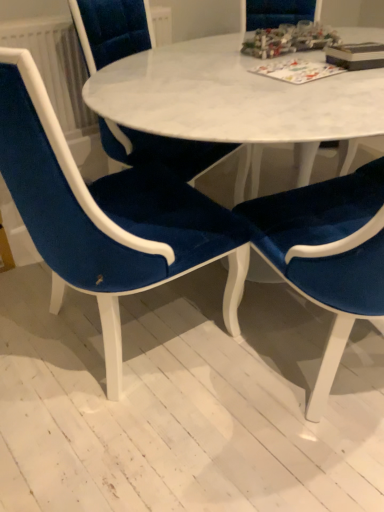
Describe the element at coordinates (55, 65) in the screenshot. I see `white textured radiator at upper left` at that location.

Measure the distance between point (x=322, y=244) and camera.

Point (x=322, y=244) and camera are 39.29 inches apart.

What is the approximate width of hardcover book at upper right, the 2th book in the left-to-right sequence?

The width of hardcover book at upper right, the 2th book in the left-to-right sequence, is 7.43 inches.

Find the location of a particular element. matte paper board game at upper center, the 2th book from the right is located at coordinates (297, 70).

Consider the image. Is velvet blue chair at center, which ranks as the 1th chair in right-to-left order, to the left of hardcover book at upper right, which is the 1th book in right-to-left order, from the viewer's perspective?

Indeed, velvet blue chair at center, which ranks as the 1th chair in right-to-left order, is positioned on the left side of hardcover book at upper right, which is the 1th book in right-to-left order.

Is velvet blue chair at center, the third chair positioned from the left, facing away from hardcover book at upper right, the 2th book in the left-to-right sequence?

No.

From the image's perspective, is velvet blue chair at center, which ranks as the 1th chair in right-to-left order, beneath hardcover book at upper right, which is the 1th book in right-to-left order?

Yes, from the image's perspective, velvet blue chair at center, which ranks as the 1th chair in right-to-left order, is beneath hardcover book at upper right, which is the 1th book in right-to-left order.

Can you confirm if velvet blue chair at center, which ranks as the 1th chair in right-to-left order, is thinner than hardcover book at upper right, which is the 1th book in right-to-left order?

Incorrect, the width of velvet blue chair at center, which ranks as the 1th chair in right-to-left order, is not less than that of hardcover book at upper right, which is the 1th book in right-to-left order.

Considering the sizes of matte paper board game at upper center, the 2th book from the right, and velvet blue chair at center, which ranks as the 1th chair in right-to-left order, in the image, is matte paper board game at upper center, the 2th book from the right, wider or thinner than velvet blue chair at center, which ranks as the 1th chair in right-to-left order,?

Clearly, matte paper board game at upper center, the 2th book from the right, has less width compared to velvet blue chair at center, which ranks as the 1th chair in right-to-left order.

From the image's perspective, is matte paper board game at upper center, acting as the first book starting from the left, located above or below velvet blue chair at center, which ranks as the 1th chair in right-to-left order?

matte paper board game at upper center, acting as the first book starting from the left, is situated higher than velvet blue chair at center, which ranks as the 1th chair in right-to-left order, in the image.

Find the location of `the 3rd chair in front of the matte paper board game at upper center, the 2th book from the right, starting your count from the anchor`. the 3rd chair in front of the matte paper board game at upper center, the 2th book from the right, starting your count from the anchor is located at coordinates (327, 253).

From the image's perspective, who appears lower, velvet blue chair at lower left, the 3th chair in the right-to-left sequence, or white textured radiator at upper left?

velvet blue chair at lower left, the 3th chair in the right-to-left sequence, is shown below in the image.

Considering the relative sizes of velvet blue chair at lower left, the 3th chair in the right-to-left sequence, and white textured radiator at upper left in the image provided, is velvet blue chair at lower left, the 3th chair in the right-to-left sequence, taller than white textured radiator at upper left?

Yes.

Are velvet blue chair at lower left, the 3th chair in the right-to-left sequence, and white textured radiator at upper left beside each other?

No, velvet blue chair at lower left, the 3th chair in the right-to-left sequence, is not with white textured radiator at upper left.

From a real-world perspective, which is physically below, velvet blue chair at lower left, the 3th chair in the right-to-left sequence, or white textured radiator at upper left?

From a 3D spatial view, velvet blue chair at lower left, the 3th chair in the right-to-left sequence, is below.

Is hardcover book at upper right, which is the 1th book in right-to-left order, in contact with velvet blue chair at lower left, the 3th chair in the right-to-left sequence?

No.

From the image's perspective, between hardcover book at upper right, which is the 1th book in right-to-left order, and velvet blue chair at lower left, which is the 1th chair from left to right, who is located below?

velvet blue chair at lower left, which is the 1th chair from left to right.

Can you confirm if hardcover book at upper right, the 2th book in the left-to-right sequence, is taller than velvet blue chair at lower left, which is the 1th chair from left to right?

No.

The image size is (384, 512). Identify the location of book that is the 2nd object located above the velvet blue chair at lower left, the 3th chair in the right-to-left sequence (from the image's perspective). (356, 55).

Is point (380, 60) closer or farther from the camera than point (295, 61)?

Point (380, 60) is closer to the camera than point (295, 61).

Considering the relative positions of hardcover book at upper right, which is the 1th book in right-to-left order, and matte paper board game at upper center, acting as the first book starting from the left, in the image provided, is hardcover book at upper right, which is the 1th book in right-to-left order, behind matte paper board game at upper center, acting as the first book starting from the left,?

Yes, it is.

Between hardcover book at upper right, the 2th book in the left-to-right sequence, and matte paper board game at upper center, acting as the first book starting from the left, which one has smaller size?

matte paper board game at upper center, acting as the first book starting from the left.

Which is correct: hardcover book at upper right, which is the 1th book in right-to-left order, is inside matte paper board game at upper center, acting as the first book starting from the left, or outside of it?

hardcover book at upper right, which is the 1th book in right-to-left order, is located beyond the bounds of matte paper board game at upper center, acting as the first book starting from the left.

Considering the relative positions of velvet blue chair at center, which ranks as the 1th chair in right-to-left order, and velvet blue chair at center, which is the second chair from left to right, in the image provided, is velvet blue chair at center, which ranks as the 1th chair in right-to-left order, behind velvet blue chair at center, which is the second chair from left to right,?

No, it is not.

From a real-world perspective, count 2nd chairs downward from the velvet blue chair at center, which is the second chair from left to right, and point to it. Please provide its 2D coordinates.

[(327, 253)]

Is velvet blue chair at center, which ranks as the 1th chair in right-to-left order, bigger than velvet blue chair at center, the 2th chair viewed from the right?

Indeed, velvet blue chair at center, which ranks as the 1th chair in right-to-left order, has a larger size compared to velvet blue chair at center, the 2th chair viewed from the right.

Considering the sizes of objects matte paper board game at upper center, the 2th book from the right, and hardcover book at upper right, the 2th book in the left-to-right sequence, in the image provided, who is bigger, matte paper board game at upper center, the 2th book from the right, or hardcover book at upper right, the 2th book in the left-to-right sequence,?

hardcover book at upper right, the 2th book in the left-to-right sequence, is bigger.

Which of these two, matte paper board game at upper center, the 2th book from the right, or hardcover book at upper right, which is the 1th book in right-to-left order, is thinner?

hardcover book at upper right, which is the 1th book in right-to-left order, is thinner.

Based on the photo, from a real-world perspective, is matte paper board game at upper center, the 2th book from the right, positioned above or below hardcover book at upper right, the 2th book in the left-to-right sequence?

In terms of real-world spatial position, matte paper board game at upper center, the 2th book from the right, is below hardcover book at upper right, the 2th book in the left-to-right sequence.

Consider the image. From the image's perspective, is matte paper board game at upper center, acting as the first book starting from the left, below hardcover book at upper right, the 2th book in the left-to-right sequence?

Correct, matte paper board game at upper center, acting as the first book starting from the left, appears lower than hardcover book at upper right, the 2th book in the left-to-right sequence, in the image.

Locate an element on the screen. Image resolution: width=384 pixels, height=512 pixels. book on the right of velvet blue chair at center, the third chair positioned from the left is located at coordinates (356, 55).

From a real-world perspective, which book is the 1st one above the velvet blue chair at center, the third chair positioned from the left? Please provide its 2D coordinates.

[(297, 70)]

Estimate the real-world distances between objects in this image. Which object is closer to velvet blue chair at center, which ranks as the 1th chair in right-to-left order, velvet blue chair at center, the 2th chair viewed from the right, or matte paper board game at upper center, the 2th book from the right?

The object closer to velvet blue chair at center, which ranks as the 1th chair in right-to-left order, is matte paper board game at upper center, the 2th book from the right.

Considering their positions, is velvet blue chair at center, which is the second chair from left to right, positioned closer to velvet blue chair at lower left, which is the 1th chair from left to right, than matte paper board game at upper center, the 2th book from the right?

The object closer to velvet blue chair at lower left, which is the 1th chair from left to right, is velvet blue chair at center, which is the second chair from left to right.

Based on their spatial positions, is white textured radiator at upper left or matte paper board game at upper center, the 2th book from the right, closer to velvet blue chair at center, which ranks as the 1th chair in right-to-left order?

The object closer to velvet blue chair at center, which ranks as the 1th chair in right-to-left order, is matte paper board game at upper center, the 2th book from the right.

Estimate the real-world distances between objects in this image. Which object is further from velvet blue chair at lower left, which is the 1th chair from left to right, velvet blue chair at center, which is the second chair from left to right, or hardcover book at upper right, which is the 1th book in right-to-left order?

Based on the image, hardcover book at upper right, which is the 1th book in right-to-left order, appears to be further to velvet blue chair at lower left, which is the 1th chair from left to right.

Considering their positions, is matte paper board game at upper center, acting as the first book starting from the left, positioned closer to velvet blue chair at lower left, the 3th chair in the right-to-left sequence, than velvet blue chair at center, the 2th chair viewed from the right?

velvet blue chair at center, the 2th chair viewed from the right, is positioned closer to the anchor velvet blue chair at lower left, the 3th chair in the right-to-left sequence.

From the image, which object appears to be farther from velvet blue chair at center, which ranks as the 1th chair in right-to-left order, white textured radiator at upper left or velvet blue chair at lower left, the 3th chair in the right-to-left sequence?

Among the two, white textured radiator at upper left is located further to velvet blue chair at center, which ranks as the 1th chair in right-to-left order.

Considering their positions, is white textured radiator at upper left positioned closer to velvet blue chair at lower left, which is the 1th chair from left to right, than velvet blue chair at center, the 2th chair viewed from the right?

velvet blue chair at center, the 2th chair viewed from the right.

Estimate the real-world distances between objects in this image. Which object is further from velvet blue chair at lower left, the 3th chair in the right-to-left sequence, velvet blue chair at center, the third chair positioned from the left, or matte paper board game at upper center, acting as the first book starting from the left?

matte paper board game at upper center, acting as the first book starting from the left.

The height and width of the screenshot is (512, 384). Identify the location of chair situated between velvet blue chair at lower left, the 3th chair in the right-to-left sequence, and velvet blue chair at center, the third chair positioned from the left, from left to right. (172, 153).

Where is `chair between velvet blue chair at lower left, the 3th chair in the right-to-left sequence, and matte paper board game at upper center, the 2th book from the right, along the z-axis`? The image size is (384, 512). chair between velvet blue chair at lower left, the 3th chair in the right-to-left sequence, and matte paper board game at upper center, the 2th book from the right, along the z-axis is located at coordinates (172, 153).

What are the coordinates of `book located between velvet blue chair at lower left, which is the 1th chair from left to right, and hardcover book at upper right, which is the 1th book in right-to-left order, in the depth direction` in the screenshot? It's located at (297, 70).

Locate an element on the screen. book situated between velvet blue chair at center, which is the second chair from left to right, and hardcover book at upper right, which is the 1th book in right-to-left order, from left to right is located at coordinates (297, 70).